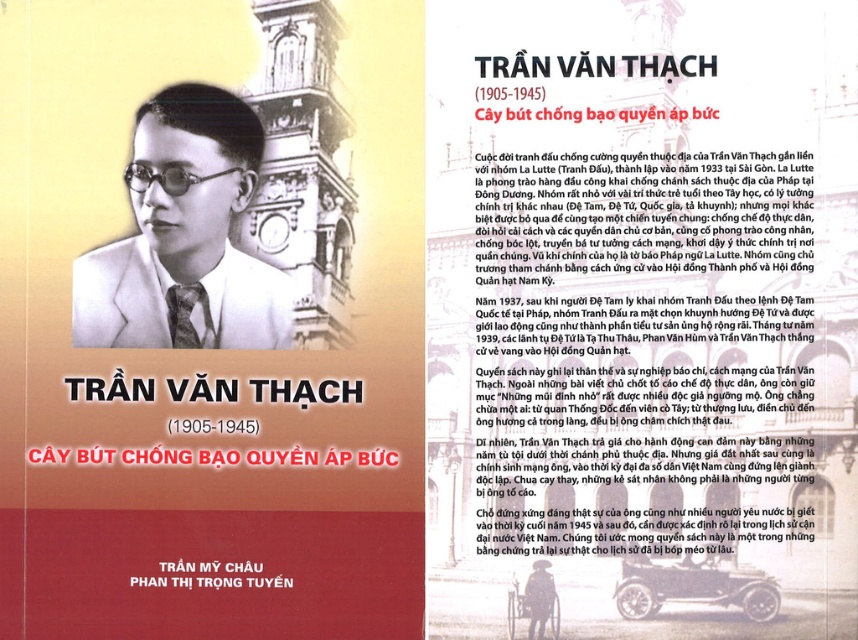
Question: Does matte black suit at center appear on the left side of black paper at upper center?

Choices:
 (A) yes
 (B) no

Answer: (A)

Question: Which object is closer to the camera taking this photo?

Choices:
 (A) matte white book cover at center
 (B) white paper at upper center
 (C) black paper at upper center
 (D) matte black tie at center

Answer: (A)

Question: Is white paper at upper center further to camera compared to black paper at upper center?

Choices:
 (A) no
 (B) yes

Answer: (A)

Question: Is white paper at upper center above black paper at upper center?

Choices:
 (A) no
 (B) yes

Answer: (B)

Question: Which of the following is the farthest from the observer?

Choices:
 (A) white paper at upper center
 (B) matte black tie at center
 (C) matte white book cover at center

Answer: (B)

Question: Based on their relative distances, which object is farther from the black paper at upper center?

Choices:
 (A) matte black suit at center
 (B) matte white book cover at center

Answer: (A)